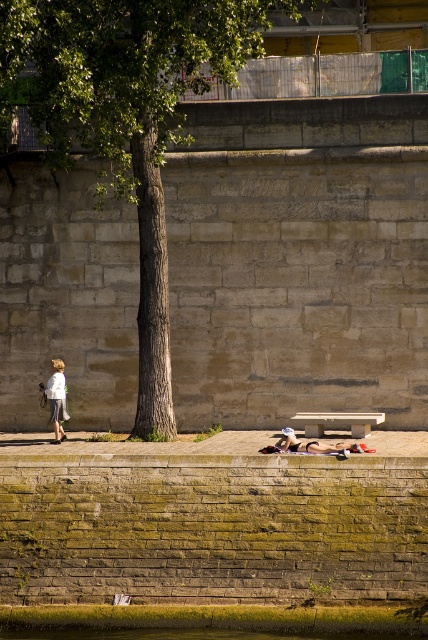
You are a photographer standing on the riverside stone wall. You want to capture a photo of the green water at lower left and the white cotton shirt at left. Which object will occupy more space in your photo?

The green water at lower left will occupy more space in the photo because it has a larger size compared to the white cotton shirt at left.

You are standing on the stone wall in the riverside scene. You see the green water at lower left and the white cotton shirt at left. Which object is closer to the edge of the stone wall?

The green water at lower left is closer to the edge of the stone wall because it is positioned under the white cotton shirt at left, meaning it is lower and nearer to the wall edge.

You are standing at the riverside and see the green leafy tree at center. If you want to walk directly towards the tree from your current position, which direction should you face?

The green leafy tree at center is located at point (127, 118), so you should face towards the center of the image to walk directly towards it.